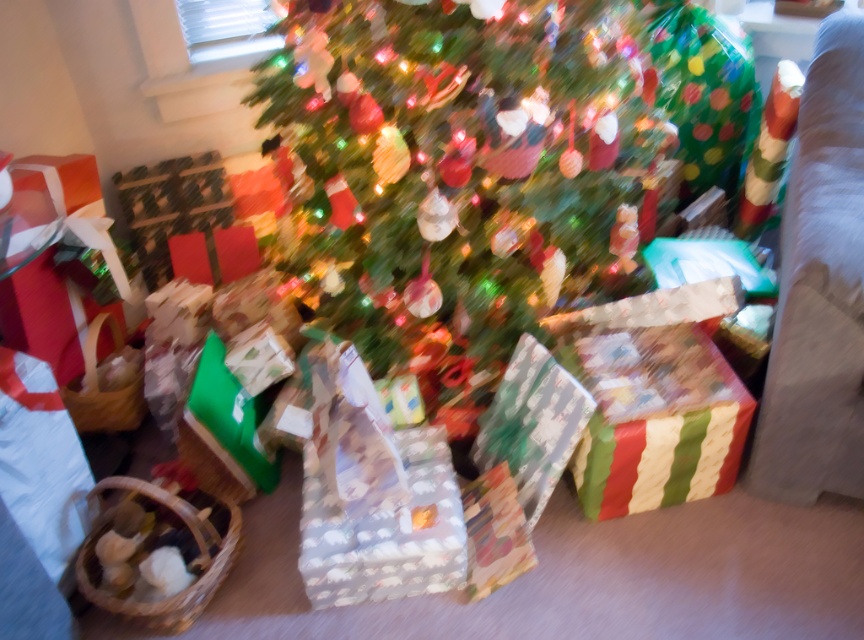
You are sitting in the white fabric armchair at right and want to reach the shiny green tree at center to grab an ornament. Which direction should you move to get closer to the tree?

Since the shiny green tree at center is closer to you than the white fabric armchair at right, you are already in a position where the tree is in front of you. To reach it, you should move forward from the white fabric armchair at right towards the tree.

You are standing in front of the Christmas tree and want to place a gift at point [613,83] and another gift at point [843,442]. Which gift will be closer to the camera?

The gift placed at point [843,442] will be closer to the camera since point [613,83] is behind point [843,442].